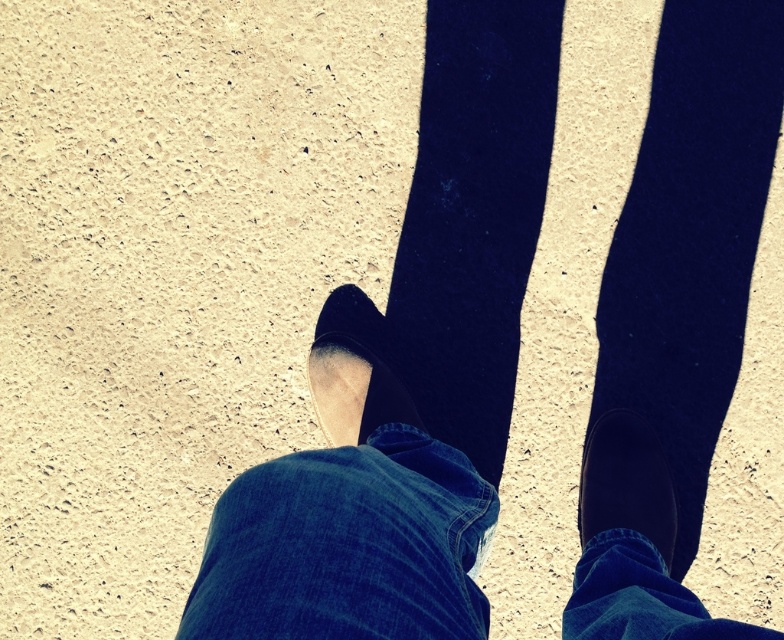
You are standing on the textured ground in the image and notice the denim at center and the suede black shoe at center. From your perspective, which object is positioned to the right side?

The denim at center is positioned to the right of the suede black shoe at center.

From the picture: You are standing on the textured ground and see the denim at center and the black suede shoe at lower right. Which object is closer to your feet?

The black suede shoe at lower right is closer to your feet because the denim at center is positioned under it, indicating it is further away.

You are standing on the textured ground and see the suede black shoe at center and the black suede shoe at lower right. Which shoe is covering the other?

The suede black shoe at center is positioned over the black suede shoe at lower right, so it is covering the other shoe.